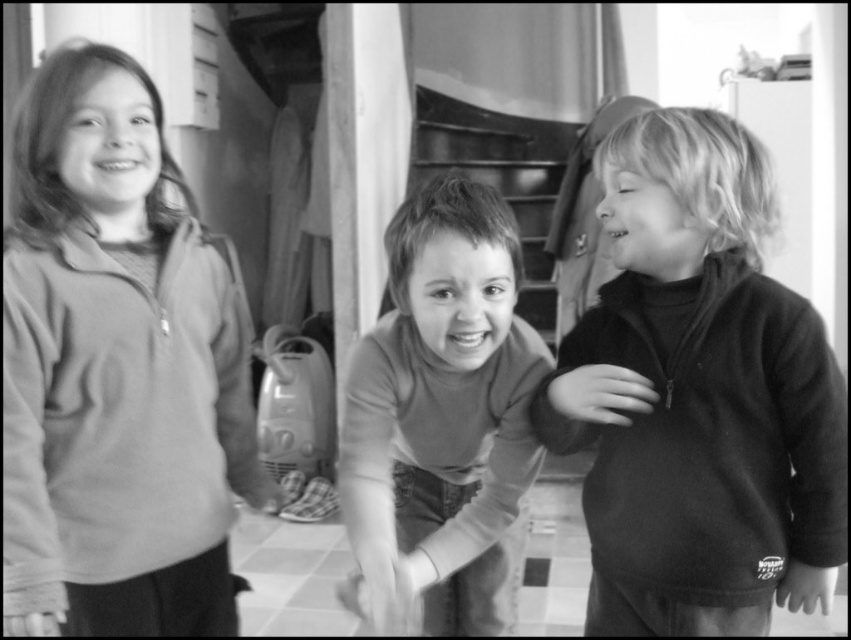
You are standing at the origin point in the image. There is a soft fleece sweatshirt at left represented by point (116, 371). Can you determine the direction of the soft fleece sweatshirt at left from your current position?

The soft fleece sweatshirt at left is located at point (116, 371), which is to the left side of the image. Therefore, the direction of the soft fleece sweatshirt at left from the origin point is to the left.

You are a tailor who needs to determine which item requires more fabric to make between the velvet black sweater at right and the smooth brown shirt at center. Based on their sizes in the image, which one would need more fabric?

The smooth brown shirt at center requires more fabric because it occupies more space than the velvet black sweater at right in the image.